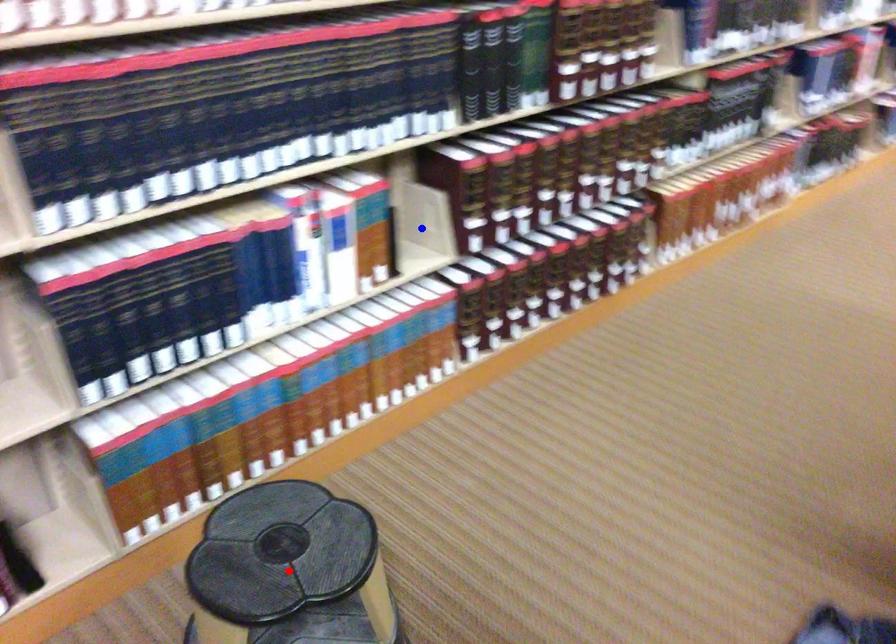
Question: In the image, two points are highlighted. Which point is nearer to the camera? Reply with the corresponding letter.

Choices:
 (A) blue point
 (B) red point

Answer: (B)